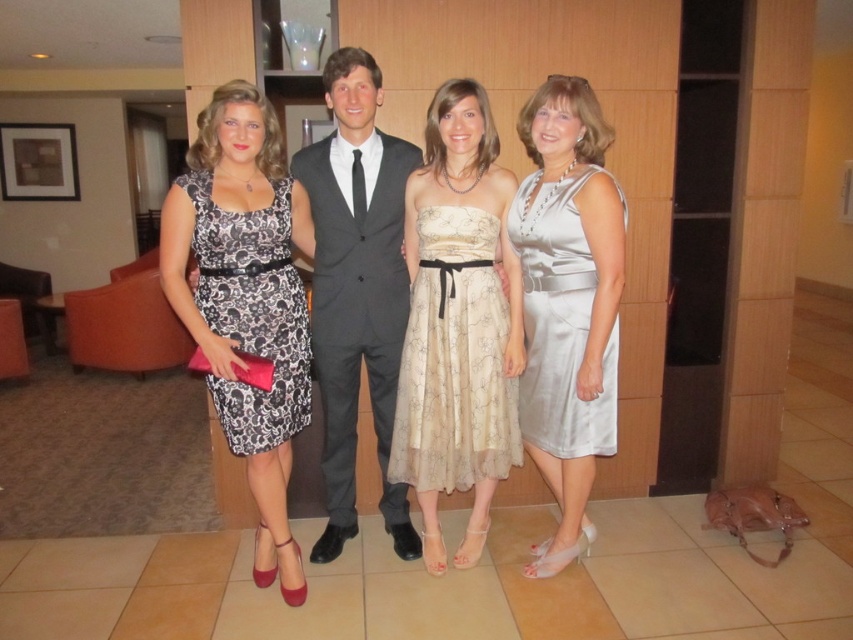
Question: Is printed fabric dress at center above black lace dress at left?

Choices:
 (A) no
 (B) yes

Answer: (A)

Question: Which of the following is the closest to the observer?

Choices:
 (A) black lace dress at left
 (B) satin silver dress at right
 (C) matte black dress at center

Answer: (A)

Question: Which of the following is the closest to the observer?

Choices:
 (A) matte black dress at center
 (B) matte gray suit at center
 (C) satin silver dress at right
 (D) beige floral chiffon dress at center

Answer: (A)

Question: Observing the image, what is the correct spatial positioning of printed fabric dress at center in reference to beige floral chiffon dress at center?

Choices:
 (A) left
 (B) right

Answer: (A)

Question: Considering the real-world distances, which object is closest to the black lace dress at left?

Choices:
 (A) matte black dress at center
 (B) satin silver dress at right
 (C) matte gray suit at center
 (D) beige floral chiffon dress at center

Answer: (C)

Question: Can you confirm if matte black dress at center is positioned below matte gray suit at center?

Choices:
 (A) yes
 (B) no

Answer: (A)